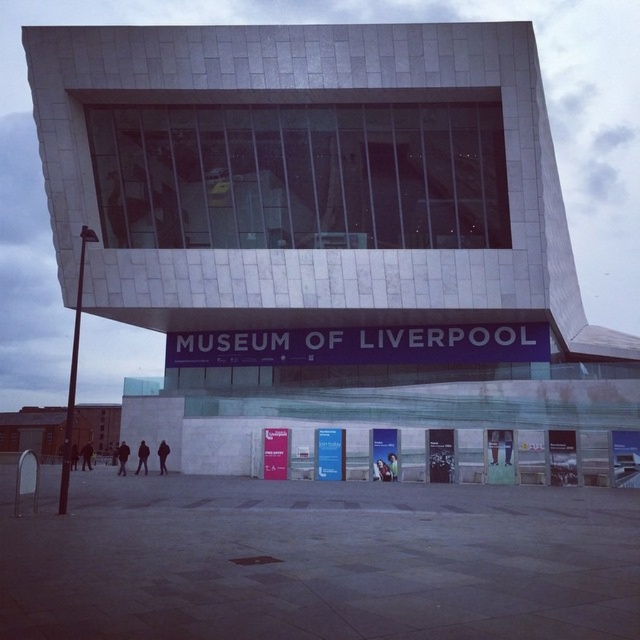
You are a photographer planning to take a photo of the Museum of Liverpool. You notice a light brown leather jacket at center and a black fabric person at lower left in your frame. Which object should you move closer to ensure both fit in the photo without overlapping?

Since the light brown leather jacket at center occupies less space than the black fabric person at lower left, you should move closer to the black fabric person at lower left to ensure both fit without overlapping.

You are a security guard at the Museum of Liverpool and need to store two leather jackets temporarily. The storage locker has a maximum width capacity of 1.2 meters. If the dark brown leather jacket at lower center is 1.3 meters wide and the light brown leather jacket at center is 1.1 meters wide, can both jackets fit into the locker when placed side by side?

The dark brown leather jacket at lower center is 1.3 meters wide and the light brown leather jacket at center is 1.1 meters wide. The total width of both jackets combined is 2.4 meters, which exceeds the locker capacity of 1.2 meters. Therefore, they cannot fit side by side in the locker.

You are a security guard at the Museum of Liverpool. You need to place a black leather jacket at lower center and a green fabric jacket at center in a display case. The display case has a width of 1.2 meters. Can both jackets fit side by side without overlapping?

The black leather jacket at lower center might be wider than the green fabric jacket at center. If the black leather jacket at lower center is indeed wider, their combined width could exceed the display case width of 1.2 meters, so they might not fit. If the black leather jacket at lower center is not wider, they might fit. The exact fit depends on their actual widths.